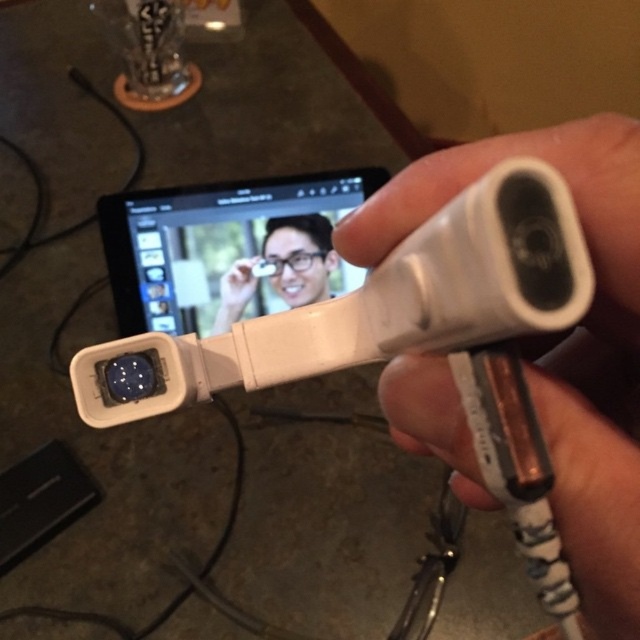
Is white plastic remote control at center smaller than black glossy tablet at center?

Correct, white plastic remote control at center occupies less space than black glossy tablet at center.

Which is more to the left, white plastic remote control at center or black glossy tablet at center?

Positioned to the left is black glossy tablet at center.

Between point (483, 276) and point (179, 310), which one is positioned in front?

Positioned in front is point (483, 276).

Find the location of a particular element. This screenshot has height=640, width=640. white plastic remote control at center is located at coordinates (376, 305).

In order to click on white matte plastic controller at center in this screenshot , I will do `click(563, 340)`.

In the scene shown: Is white matte plastic controller at center thinner than black glossy tablet at center?

Yes, white matte plastic controller at center is thinner than black glossy tablet at center.

This screenshot has height=640, width=640. Describe the element at coordinates (563, 340) in the screenshot. I see `white matte plastic controller at center` at that location.

At what (x,y) coordinates should I click in order to perform the action: click on white matte plastic controller at center. Please return your answer as a coordinate pair (x, y). The width and height of the screenshot is (640, 640). Looking at the image, I should click on (563, 340).

In the scene shown: Does white matte plastic controller at center have a greater width compared to matte white phone at center?

Indeed, white matte plastic controller at center has a greater width compared to matte white phone at center.

Does white matte plastic controller at center have a lesser height compared to matte white phone at center?

No, white matte plastic controller at center is not shorter than matte white phone at center.

Is point (616, 292) less distant than point (269, 280)?

Yes, point (616, 292) is in front of point (269, 280).

Locate an element on the screen. white matte plastic controller at center is located at coordinates (563, 340).